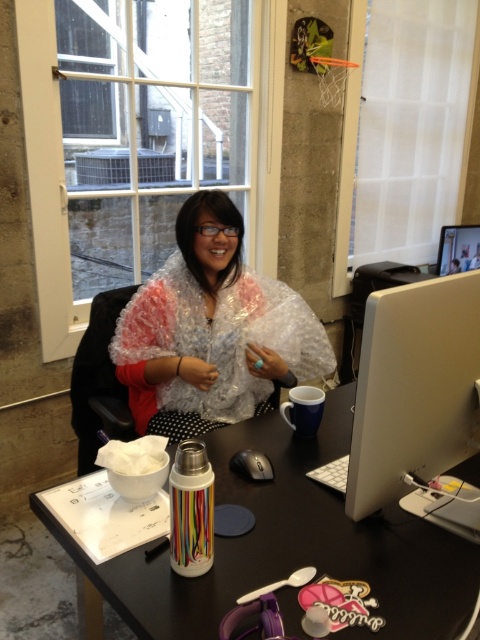
Can you confirm if clear plastic bubble wrap at center is smaller than blue ceramic mug at right?

Actually, clear plastic bubble wrap at center might be larger than blue ceramic mug at right.

Who is shorter, clear plastic bubble wrap at center or blue ceramic mug at right?

blue ceramic mug at right

Describe the element at coordinates (212, 330) in the screenshot. The image size is (480, 640). I see `clear plastic bubble wrap at center` at that location.

At what (x,y) coordinates should I click in order to perform the action: click on clear plastic bubble wrap at center. Please return your answer as a coordinate pair (x, y). Looking at the image, I should click on (212, 330).

Does sleek silver monitor at upper right have a larger size compared to blue ceramic mug at right?

Yes, sleek silver monitor at upper right is bigger than blue ceramic mug at right.

Is the position of sleek silver monitor at upper right more distant than that of blue ceramic mug at right?

No.

Locate an element on the screen. sleek silver monitor at upper right is located at coordinates (414, 388).

The width and height of the screenshot is (480, 640). I want to click on sleek silver monitor at upper right, so click(414, 388).

Is metallic thermos at center thinner than sleek silver monitor at upper right?

In fact, metallic thermos at center might be wider than sleek silver monitor at upper right.

Can you confirm if metallic thermos at center is taller than sleek silver monitor at upper right?

No.

Image resolution: width=480 pixels, height=640 pixels. I want to click on metallic thermos at center, so 294,545.